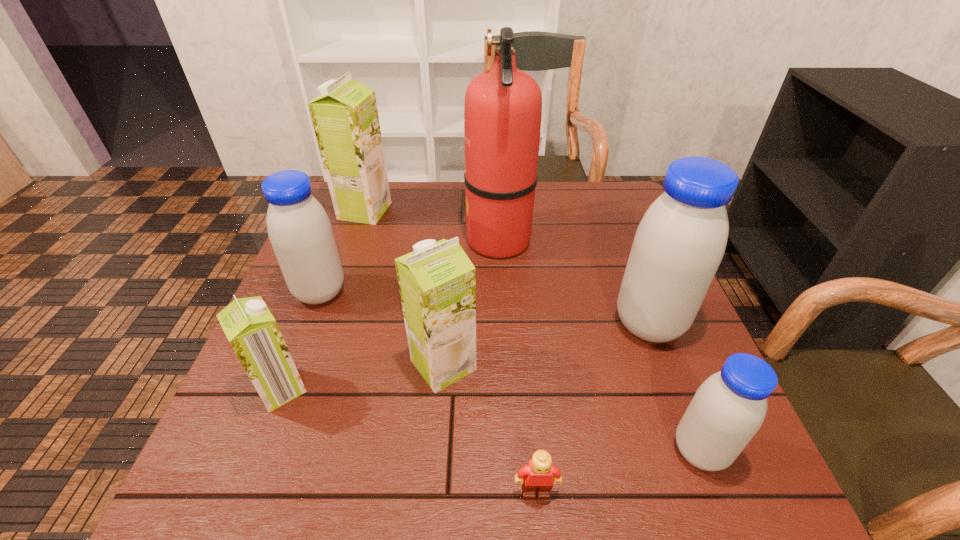
Locate an element on the screen. The height and width of the screenshot is (540, 960). vacant region at the left edge is located at coordinates (368, 229).

In the image, there is a desktop. At what (x,y) coordinates should I click in order to perform the action: click on vacant space at the far right corner. Please return your answer as a coordinate pair (x, y). The width and height of the screenshot is (960, 540). Looking at the image, I should click on pyautogui.click(x=609, y=203).

Where is `empty space between the nearest blue soya milk and the second smallest blue soya milk`? Image resolution: width=960 pixels, height=540 pixels. empty space between the nearest blue soya milk and the second smallest blue soya milk is located at coordinates (510, 372).

Where is `free spot between the brown Lego and the biggest blue soya milk`? The image size is (960, 540). free spot between the brown Lego and the biggest blue soya milk is located at coordinates (592, 408).

At what (x,y) coordinates should I click in order to perform the action: click on empty space that is in between the biggest blue soya milk and the biggest green soya milk. Please return your answer as a coordinate pair (x, y). This screenshot has width=960, height=540. Looking at the image, I should click on (507, 267).

I want to click on free space between the fire extinguisher and the smallest green soya milk, so click(x=390, y=314).

At what (x,y) coordinates should I click in order to perform the action: click on free space between the second smallest blue soya milk and the biggest blue soya milk. Please return your answer as a coordinate pair (x, y). Looking at the image, I should click on (485, 308).

At what (x,y) coordinates should I click in order to perform the action: click on empty space between the biggest blue soya milk and the tallest object. Please return your answer as a coordinate pair (x, y). This screenshot has height=540, width=960. Looking at the image, I should click on (574, 281).

Where is `vacant space that's between the shortest object and the second smallest blue soya milk`? Image resolution: width=960 pixels, height=540 pixels. vacant space that's between the shortest object and the second smallest blue soya milk is located at coordinates (428, 392).

In order to click on object that can be found as the fourth closest to the third soya milk from right to left in this screenshot , I will do `click(503, 105)`.